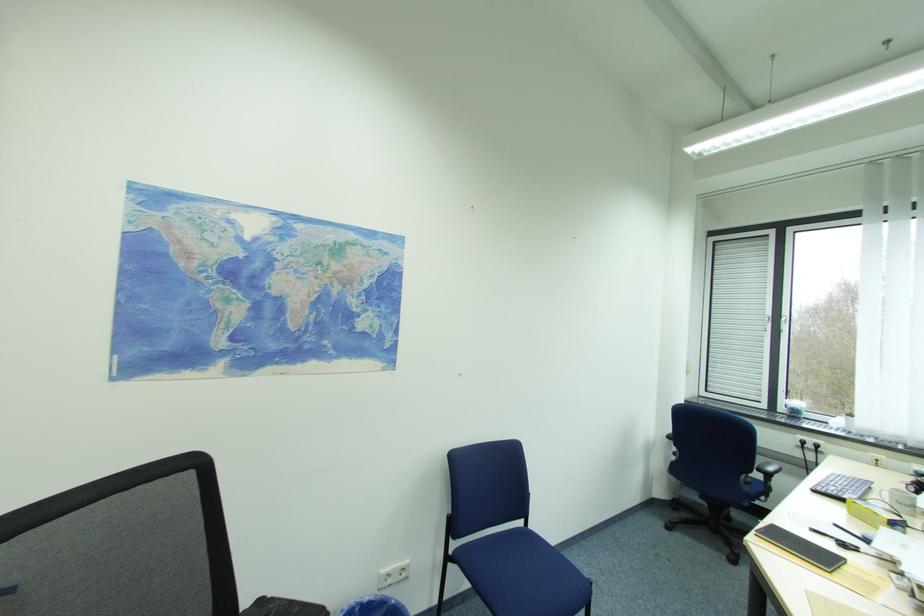
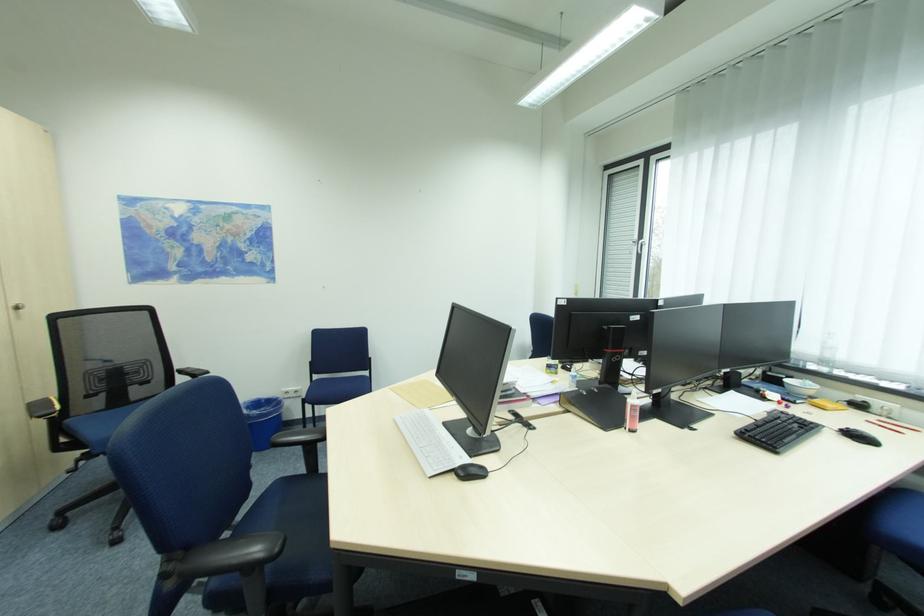
The images are taken continuously from a first-person perspective. In which direction are you moving?

The cameraman moved toward right, backward.